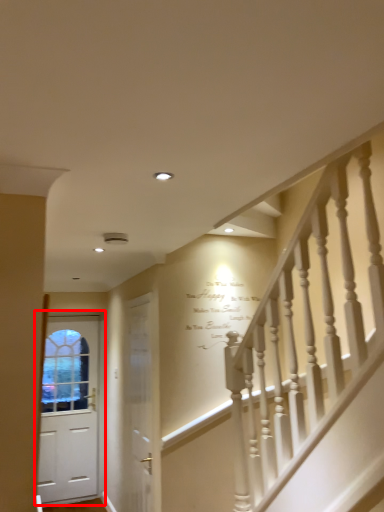
Question: From the image's perspective, what is the correct spatial relationship of door (annotated by the red box) in relation to door?

Choices:
 (A) above
 (B) below

Answer: (B)